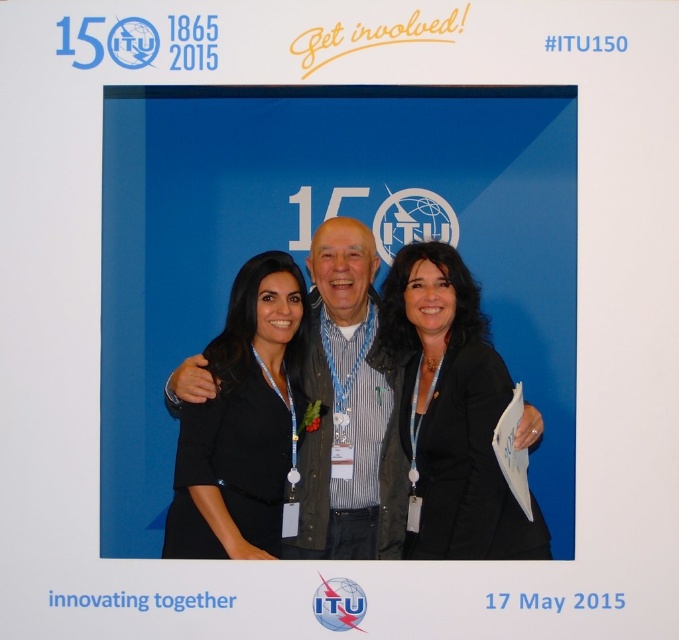
Which is in front, point (447, 358) or point (443, 440)?

Point (443, 440) is in front.

Is black striped shirt at center closer to camera compared to black matte blazer at center?

Yes, black striped shirt at center is closer to the viewer.

Identify the location of black striped shirt at center. (426, 433).

Image resolution: width=679 pixels, height=640 pixels. Find the location of `black striped shirt at center`. black striped shirt at center is located at coordinates (426, 433).

Who is higher up, black matte blazer at center or black fabric jacket at center?

black matte blazer at center is higher up.

Which is in front, point (405, 401) or point (304, 408)?

Point (405, 401) is in front.

The height and width of the screenshot is (640, 679). I want to click on black matte blazer at center, so click(449, 410).

You are a GUI agent. You are given a task and a screenshot of the screen. Output one action in this format:
    pyautogui.click(x=<x>, y=<y>)
    Task: Click on the black striped shirt at center
    The height and width of the screenshot is (640, 679).
    Given the screenshot: What is the action you would take?
    pyautogui.click(x=426, y=433)

Is point (327, 442) positioned after point (240, 445)?

That is True.

Is point (304, 540) positioned after point (187, 438)?

Yes, it is.

Identify the location of black striped shirt at center. This screenshot has height=640, width=679. (426, 433).